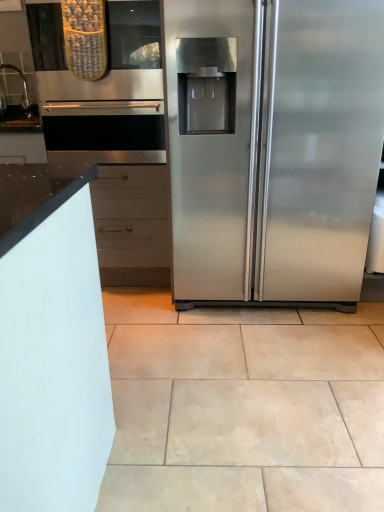
The height and width of the screenshot is (512, 384). What do you see at coordinates (243, 407) in the screenshot? I see `beige ceramic tile at center` at bounding box center [243, 407].

Locate an element on the screen. The image size is (384, 512). beige ceramic tile at center is located at coordinates (243, 407).

Which object is thinner, stainless steel refrigerator at right or satin nickel faucet at left?

Thinner between the two is satin nickel faucet at left.

From a real-world perspective, is stainless steel refrigerator at right over satin nickel faucet at left?

No, from a real-world perspective, stainless steel refrigerator at right is not above satin nickel faucet at left.

From the image's perspective, is stainless steel refrigerator at right on top of satin nickel faucet at left?

No, from the image's perspective, stainless steel refrigerator at right is not on top of satin nickel faucet at left.

Is stainless steel refrigerator at right bigger or smaller than satin nickel faucet at left?

stainless steel refrigerator at right is bigger than satin nickel faucet at left.

Is beige ceramic tile at center shorter than satin nickel faucet at left?

Yes.

How many degrees apart are the facing directions of beige ceramic tile at center and satin nickel faucet at left?

They differ by 37.9 degrees in their facing directions.

Considering the relative sizes of beige ceramic tile at center and satin nickel faucet at left in the image provided, is beige ceramic tile at center thinner than satin nickel faucet at left?

No.

In order to click on ceramic tile below the satin nickel faucet at left (from a real-world perspective) in this screenshot , I will do `click(243, 407)`.

What's the angular difference between beige ceramic tile at center and stainless steel refrigerator at right's facing directions?

There is a 2.05-degree angle between the facing directions of beige ceramic tile at center and stainless steel refrigerator at right.

Who is taller, beige ceramic tile at center or stainless steel refrigerator at right?

With more height is stainless steel refrigerator at right.

Does beige ceramic tile at center have a larger size compared to stainless steel refrigerator at right?

No.

From the picture: From the image's perspective, does satin nickel faucet at left appear lower than stainless steel refrigerator at right?

Actually, satin nickel faucet at left appears above stainless steel refrigerator at right in the image.

How many degrees apart are the facing directions of satin nickel faucet at left and stainless steel refrigerator at right?

satin nickel faucet at left and stainless steel refrigerator at right are facing 35.9 degrees away from each other.

Considering their positions, is satin nickel faucet at left located in front of or behind stainless steel refrigerator at right?

Visually, satin nickel faucet at left is located behind stainless steel refrigerator at right.

Where is `faucet located behind the stainless steel refrigerator at right`? The height and width of the screenshot is (512, 384). faucet located behind the stainless steel refrigerator at right is located at coordinates (23, 84).

Where is `ceramic tile in front of the stainless steel refrigerator at right`? The height and width of the screenshot is (512, 384). ceramic tile in front of the stainless steel refrigerator at right is located at coordinates (243, 407).

Considering the sizes of objects stainless steel refrigerator at right and beige ceramic tile at center in the image provided, who is bigger, stainless steel refrigerator at right or beige ceramic tile at center?

Bigger between the two is stainless steel refrigerator at right.

From a real-world perspective, between stainless steel refrigerator at right and beige ceramic tile at center, who is vertically higher?

stainless steel refrigerator at right is physically above.

From the image's perspective, who appears lower, satin nickel faucet at left or beige ceramic tile at center?

From the image's view, beige ceramic tile at center is below.

Which is nearer, (25, 83) or (357, 490)?

Point (25, 83) appears to be farther away from the viewer than point (357, 490).

Based on the photo, is the surface of satin nickel faucet at left in direct contact with beige ceramic tile at center?

No, satin nickel faucet at left is not touching beige ceramic tile at center.

Looking at this image, relative to beige ceramic tile at center, is satin nickel faucet at left in front or behind?

Clearly, satin nickel faucet at left is behind beige ceramic tile at center.

At what (x,y) coordinates should I click in order to perform the action: click on faucet lying above the stainless steel refrigerator at right (from the image's perspective). Please return your answer as a coordinate pair (x, y). Looking at the image, I should click on (23, 84).

Locate an element on the screen. The image size is (384, 512). faucet that appears on the left of beige ceramic tile at center is located at coordinates (23, 84).

Looking at the image, which one is located further to stainless steel refrigerator at right, beige ceramic tile at center or satin nickel faucet at left?

satin nickel faucet at left lies further to stainless steel refrigerator at right than the other object.

From the image, which object appears to be nearer to stainless steel refrigerator at right, satin nickel faucet at left or beige ceramic tile at center?

beige ceramic tile at center is positioned closer to the anchor stainless steel refrigerator at right.

When comparing their distances from satin nickel faucet at left, does beige ceramic tile at center or stainless steel refrigerator at right seem closer?

stainless steel refrigerator at right lies closer to satin nickel faucet at left than the other object.

From the picture: Estimate the real-world distances between objects in this image. Which object is closer to satin nickel faucet at left, stainless steel refrigerator at right or beige ceramic tile at center?

stainless steel refrigerator at right is positioned closer to the anchor satin nickel faucet at left.

Considering their positions, is satin nickel faucet at left positioned closer to beige ceramic tile at center than stainless steel refrigerator at right?

Based on the image, stainless steel refrigerator at right appears to be nearer to beige ceramic tile at center.

When comparing their distances from beige ceramic tile at center, does stainless steel refrigerator at right or satin nickel faucet at left seem further?

satin nickel faucet at left lies further to beige ceramic tile at center than the other object.

The height and width of the screenshot is (512, 384). I want to click on ceramic tile between satin nickel faucet at left and stainless steel refrigerator at right, so click(243, 407).